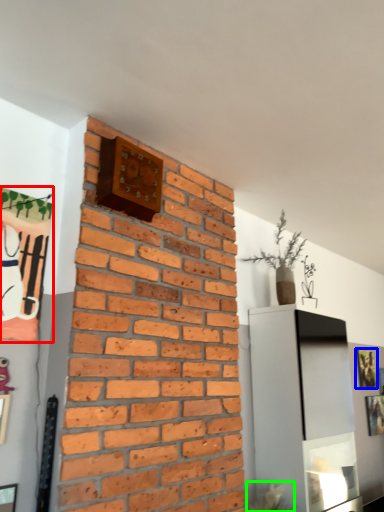
Question: Considering the real-world distances, which object is closest to picture frame (highlighted by a red box)? picture frame (highlighted by a blue box) or plant (highlighted by a green box).

Choices:
 (A) picture frame
 (B) plant

Answer: (B)